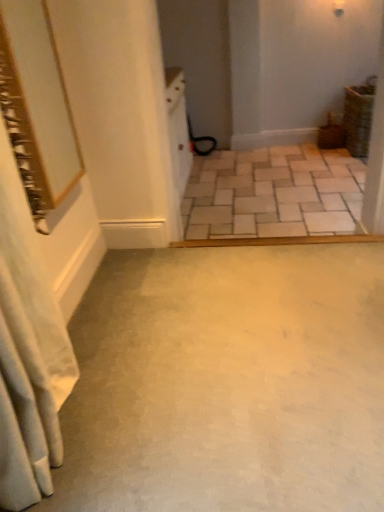
Question: Which direction should I rotate to look at smooth concrete floor at center, which is counted as the first concrete, starting from the bottom, — up or down?

Choices:
 (A) up
 (B) down

Answer: (B)

Question: Can you confirm if white fabric shower curtain at left is positioned to the right of smooth concrete floor at center, the second concrete in the back-to-front sequence?

Choices:
 (A) yes
 (B) no

Answer: (B)

Question: Does white fabric shower curtain at left have a larger size compared to smooth concrete floor at center, the second concrete in the back-to-front sequence?

Choices:
 (A) no
 (B) yes

Answer: (B)

Question: From a real-world perspective, is white fabric shower curtain at left on top of smooth concrete floor at center, the second concrete in the back-to-front sequence?

Choices:
 (A) yes
 (B) no

Answer: (A)

Question: Is white fabric shower curtain at left smaller than smooth concrete floor at center, placed as the 1th concrete when sorted from front to back?

Choices:
 (A) yes
 (B) no

Answer: (B)

Question: Is white fabric shower curtain at left shorter than smooth concrete floor at center, which is counted as the first concrete, starting from the bottom?

Choices:
 (A) no
 (B) yes

Answer: (A)

Question: Can you confirm if white fabric shower curtain at left is taller than smooth concrete floor at center, which is counted as the first concrete, starting from the bottom?

Choices:
 (A) yes
 (B) no

Answer: (A)

Question: Can you confirm if smooth concrete floor at center, placed as the 1th concrete when sorted from front to back, is shorter than gold-framed mirror at upper left?

Choices:
 (A) no
 (B) yes

Answer: (B)

Question: Could gold-framed mirror at upper left be considered to be inside smooth concrete floor at center, acting as the second concrete starting from the top?

Choices:
 (A) yes
 (B) no

Answer: (B)

Question: Does smooth concrete floor at center, which is counted as the first concrete, starting from the bottom, lie behind gold-framed mirror at upper left?

Choices:
 (A) no
 (B) yes

Answer: (A)

Question: Is smooth concrete floor at center, the second concrete in the back-to-front sequence, looking in the opposite direction of gold-framed mirror at upper left?

Choices:
 (A) yes
 (B) no

Answer: (B)

Question: Is smooth concrete floor at center, the second concrete in the back-to-front sequence, located outside gold-framed mirror at upper left?

Choices:
 (A) yes
 (B) no

Answer: (A)

Question: From the image's perspective, would you say smooth concrete floor at center, the second concrete in the back-to-front sequence, is shown under gold-framed mirror at upper left?

Choices:
 (A) yes
 (B) no

Answer: (A)

Question: From the image's perspective, is gold-framed mirror at upper left located above white fabric shower curtain at left?

Choices:
 (A) yes
 (B) no

Answer: (A)